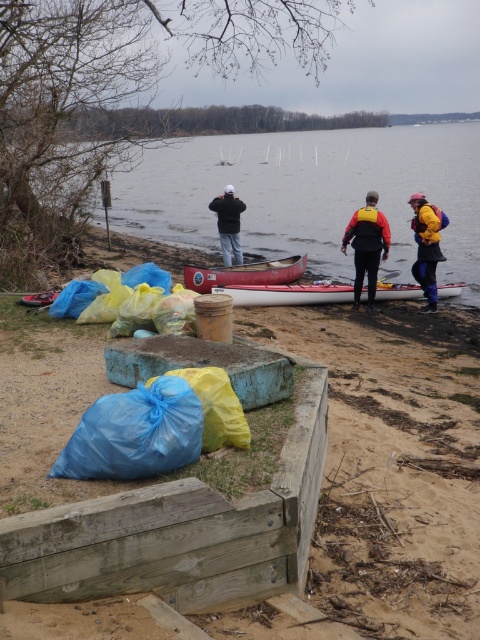
Question: Is white matte kayak at center to the right of black matte jacket at center from the viewer's perspective?

Choices:
 (A) yes
 (B) no

Answer: (A)

Question: Which is farther from the blue plastic bag at lower left?

Choices:
 (A) yellow waterproof jacket at right
 (B) red-orange life vest at center
 (C) clear water at center
 (D) black matte jacket at center

Answer: (C)

Question: Can you confirm if blue plastic bag at lower left is thinner than black matte jacket at center?

Choices:
 (A) yes
 (B) no

Answer: (B)

Question: Based on their relative distances, which object is nearer to the red matte canoe at center?

Choices:
 (A) red-orange life vest at center
 (B) white matte kayak at center

Answer: (B)

Question: Which object is the farthest from the red matte canoe at center?

Choices:
 (A) clear water at center
 (B) yellow waterproof jacket at right
 (C) red-orange life vest at center

Answer: (A)

Question: Is red matte canoe at center further to camera compared to yellow waterproof jacket at right?

Choices:
 (A) no
 (B) yes

Answer: (B)